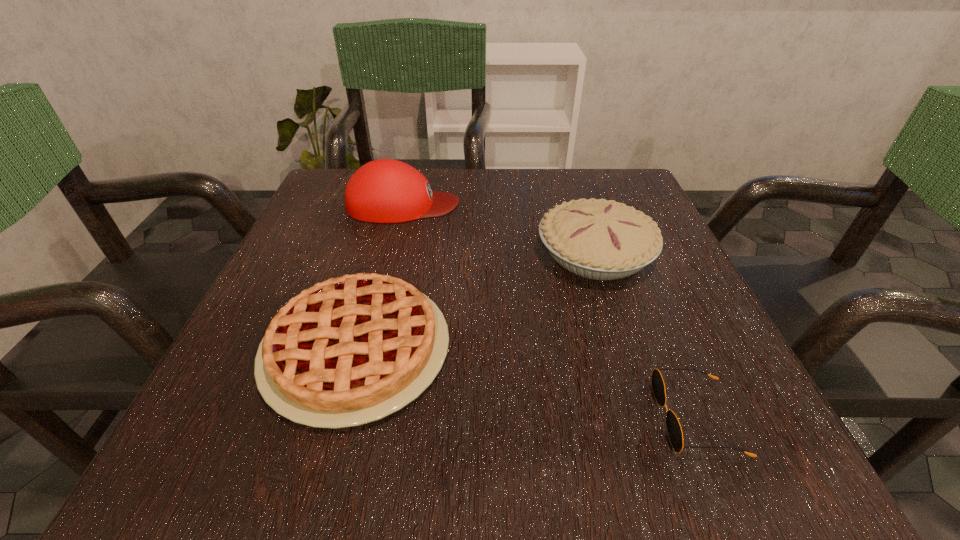
Image resolution: width=960 pixels, height=540 pixels. Find the location of `free spot that satisfies the following two spatial constraints: 1. on the front-facing side of the tallest object; 2. on the front side of the left pie`. free spot that satisfies the following two spatial constraints: 1. on the front-facing side of the tallest object; 2. on the front side of the left pie is located at coordinates (368, 349).

Identify the location of vacant space that satisfies the following two spatial constraints: 1. on the back side of the taller pie; 2. on the front-facing side of the baseball cap. (580, 205).